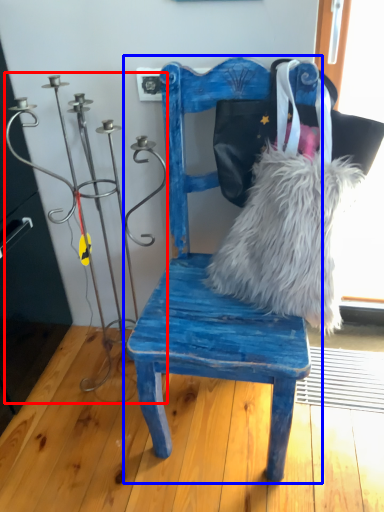
Question: Which object is further to the camera taking this photo, candle holder (highlighted by a red box) or chair (highlighted by a blue box)?

Choices:
 (A) candle holder
 (B) chair

Answer: (A)